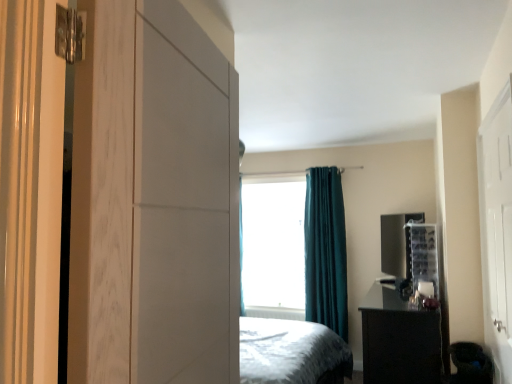
Question: Is white glossy door at right positioned beyond the bounds of black glossy nightstand at lower right?

Choices:
 (A) no
 (B) yes

Answer: (B)

Question: From the image's perspective, is white glossy door at right below black glossy nightstand at lower right?

Choices:
 (A) yes
 (B) no

Answer: (B)

Question: Is white glossy door at right oriented towards black glossy nightstand at lower right?

Choices:
 (A) no
 (B) yes

Answer: (A)

Question: From the image's perspective, would you say white glossy door at right is positioned over black glossy nightstand at lower right?

Choices:
 (A) yes
 (B) no

Answer: (A)

Question: Is white glossy door at right to the right of black glossy nightstand at lower right from the viewer's perspective?

Choices:
 (A) yes
 (B) no

Answer: (B)

Question: From a real-world perspective, is white glossy door at right on top of black glossy nightstand at lower right?

Choices:
 (A) no
 (B) yes

Answer: (B)

Question: From a real-world perspective, does transparent plastic window screen at center stand above white matte cabinet at left?

Choices:
 (A) no
 (B) yes

Answer: (A)

Question: Is transparent plastic window screen at center taller than white matte cabinet at left?

Choices:
 (A) no
 (B) yes

Answer: (B)

Question: Can white matte cabinet at left be found inside transparent plastic window screen at center?

Choices:
 (A) no
 (B) yes

Answer: (A)

Question: Considering the relative sizes of transparent plastic window screen at center and white matte cabinet at left in the image provided, is transparent plastic window screen at center smaller than white matte cabinet at left?

Choices:
 (A) no
 (B) yes

Answer: (A)

Question: Considering the relative positions of transparent plastic window screen at center and white matte cabinet at left in the image provided, is transparent plastic window screen at center to the left of white matte cabinet at left from the viewer's perspective?

Choices:
 (A) no
 (B) yes

Answer: (A)

Question: Does transparent plastic window screen at center turn towards white matte cabinet at left?

Choices:
 (A) no
 (B) yes

Answer: (B)

Question: Is black glossy nightstand at lower right oriented away from white matte cabinet at left?

Choices:
 (A) no
 (B) yes

Answer: (A)